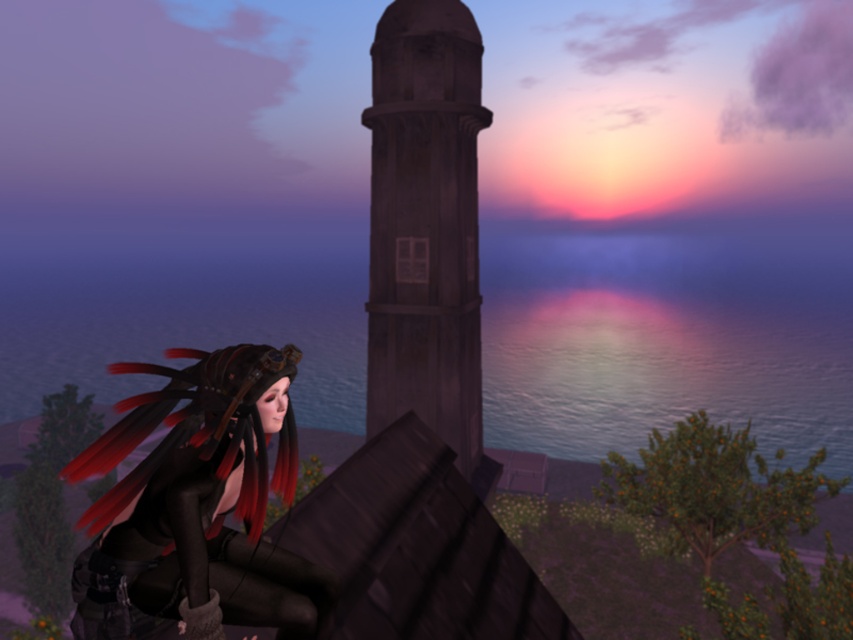
You are a photographer trying to capture the glistening blue water at center and the shiny black leather boots at lower left in a single shot. Can you position yourself so that the boots are visible in front of the water?

The shiny black leather boots at lower left are behind the glistening blue water at center, so positioning yourself to have the boots in front of the water would not be possible as they are currently positioned behind it.

You are an architect designing a new building that needs to have a view of both the glistening blue water at center and the wooden at center. Based on their positions, which object is closer to the edge of the rooftop where the character is standing?

The wooden at center is closer to the edge of the rooftop where the character is standing because the glistening blue water at center is positioned on its right side, meaning the wooden at center is nearer to the edge.

You are an architect analyzing the rooftop layout. You notice two points marked on the coordinate system of the rooftop. The first point is at coordinate point (x=200, y=260) and the second is at point (x=144, y=525). Based on the scene description, which point is closer to the edge of the rooftop where the character is standing?

Point (x=144, y=525) is closer to the edge of the rooftop where the character is standing because it is in front of point (x=200, y=260), which is behind it.